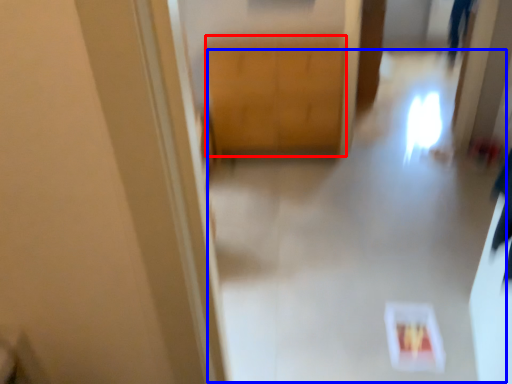
Question: Which of the following is the closest to the observer, cabinetry (highlighted by a red box) or path (highlighted by a blue box)?

Choices:
 (A) cabinetry
 (B) path

Answer: (B)